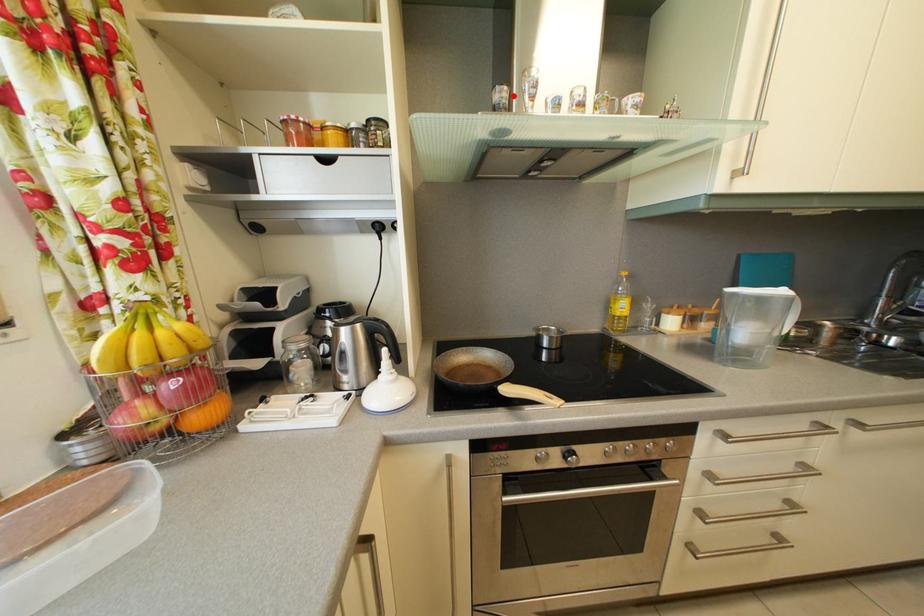
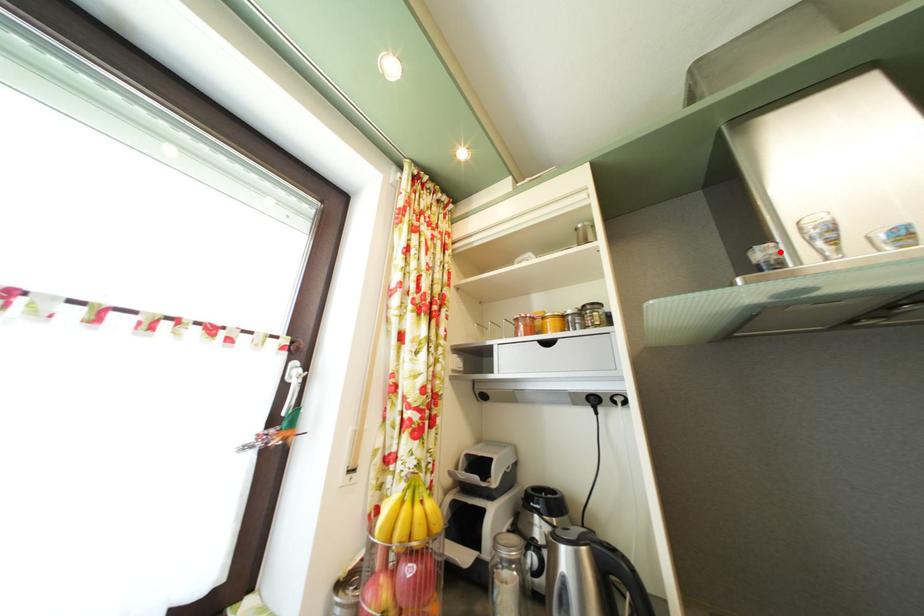
I am providing you with two images of the same scene from different viewpoints. A red point is marked on the first image and another point is marked on the second image. Is the marked point in image1 the same physical position as the marked point in image2?

Yes